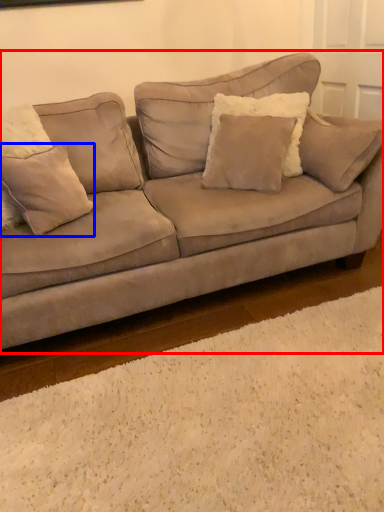
Question: Which point is closer to the camera, studio couch (highlighted by a red box) or pillow (highlighted by a blue box)?

Choices:
 (A) studio couch
 (B) pillow

Answer: (A)